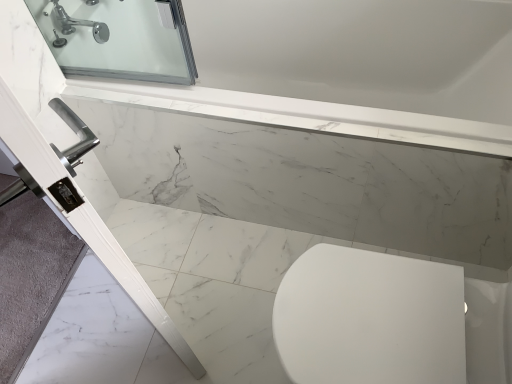
Where is `free space above white glossy bathtub at lower left (from a real-world perspective)`? The image size is (512, 384). free space above white glossy bathtub at lower left (from a real-world perspective) is located at coordinates (194, 309).